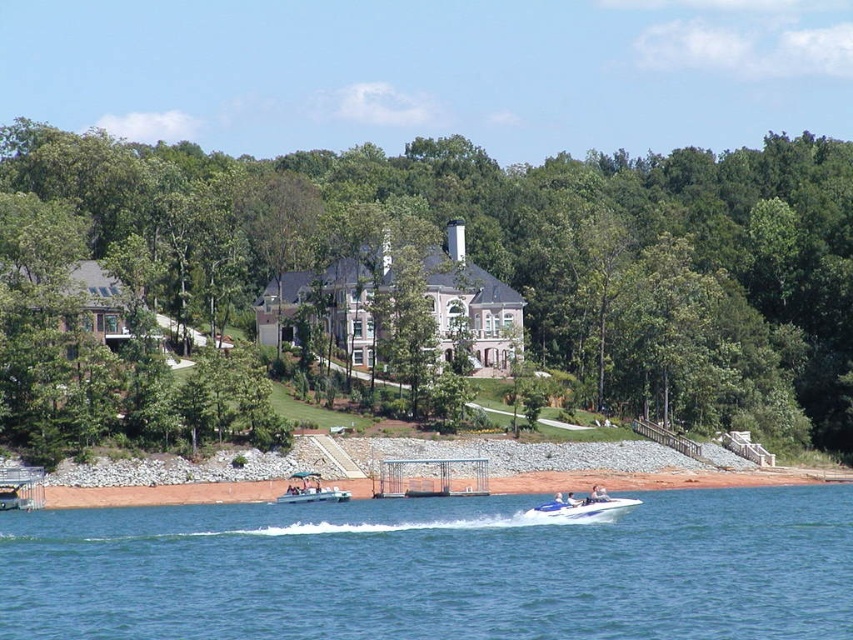
You are planning to organize a small boat race between the blue water at lower center and the white plastic boat at center. Which one would you choose as the race track and why?

The blue water at lower center has a larger size compared to the white plastic boat at center, so it would be the better choice for the race track as it provides more space for the boats to maneuver.